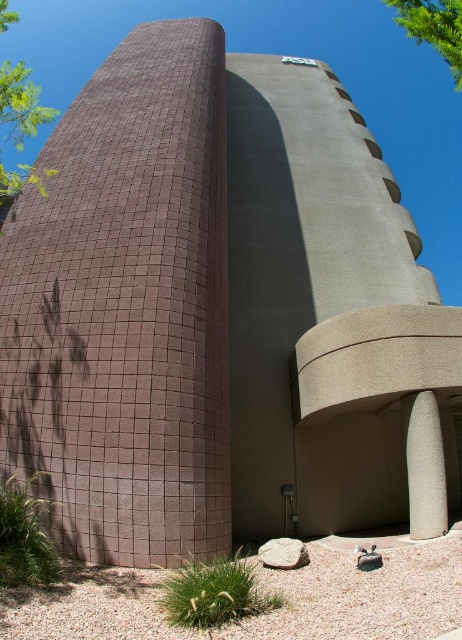
Who is positioned more to the right, green leafy tree at upper left or green leafy tree at upper right?

green leafy tree at upper right

Is point (25, 118) farther from camera compared to point (405, 3)?

That is True.

This screenshot has height=640, width=462. In order to click on green leafy tree at upper left in this screenshot , I will do `click(20, 102)`.